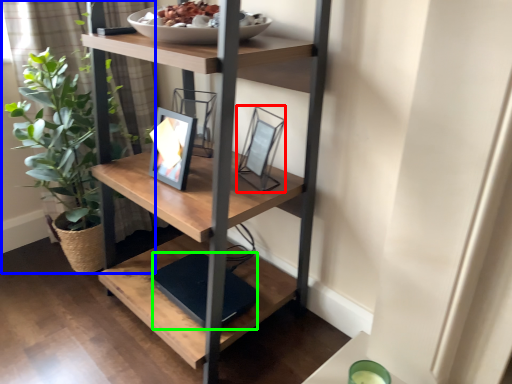
Question: Which is nearer to the picture frame (highlighted by a red box)? houseplant (highlighted by a blue box) or lift (highlighted by a green box).

Choices:
 (A) houseplant
 (B) lift

Answer: (B)